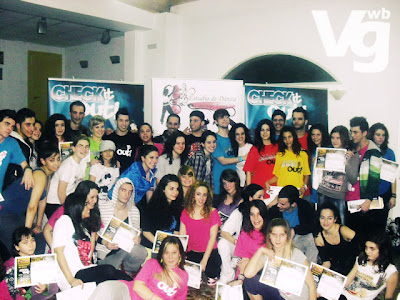
Where is `certificates`? The image size is (400, 300). certificates is located at coordinates (320, 156), (389, 176), (333, 286), (291, 282), (222, 295), (193, 271), (183, 237), (119, 239), (32, 261), (65, 144).